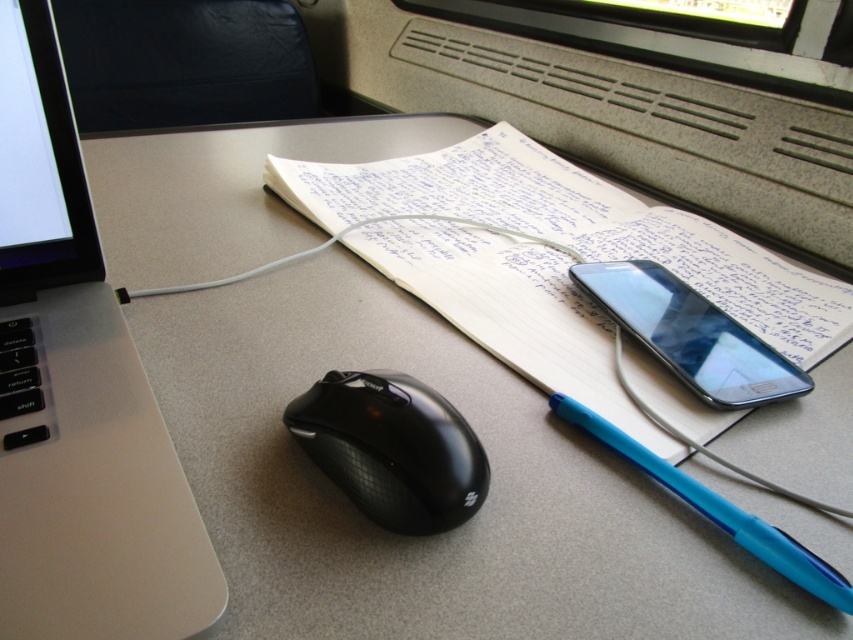
Does sleek silver laptop at left have a lesser width compared to white paper at center?

Yes.

Is the position of sleek silver laptop at left less distant than that of white paper at center?

Yes, it is.

Locate an element on the screen. sleek silver laptop at left is located at coordinates (77, 396).

Find the location of a particular element. The image size is (853, 640). white paper at center is located at coordinates (578, 227).

Is point (669, 403) positioned before point (555, 412)?

No, (669, 403) is behind (555, 412).

Does point (660, 214) come in front of point (762, 557)?

No, it is not.

Locate an element on the screen. white paper at center is located at coordinates (578, 227).

Does point (422, 408) come behind point (672, 310)?

No, (422, 408) is closer to viewer.

Which is in front, point (428, 429) or point (634, 308)?

Positioned in front is point (428, 429).

Between point (335, 408) and point (637, 314), which one is positioned behind?

Positioned behind is point (637, 314).

This screenshot has width=853, height=640. In order to click on black rubberized mouse at center in this screenshot , I will do `click(392, 449)`.